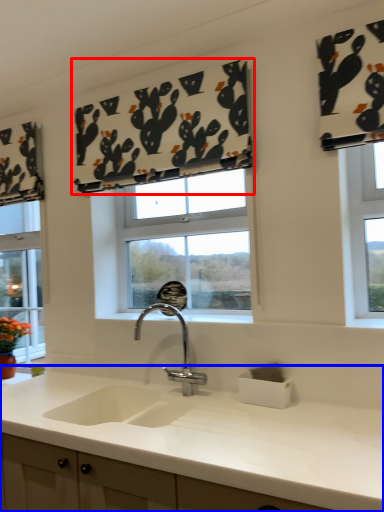
Question: Which object is further to the camera taking this photo, curtain (highlighted by a red box) or countertop (highlighted by a blue box)?

Choices:
 (A) curtain
 (B) countertop

Answer: (A)